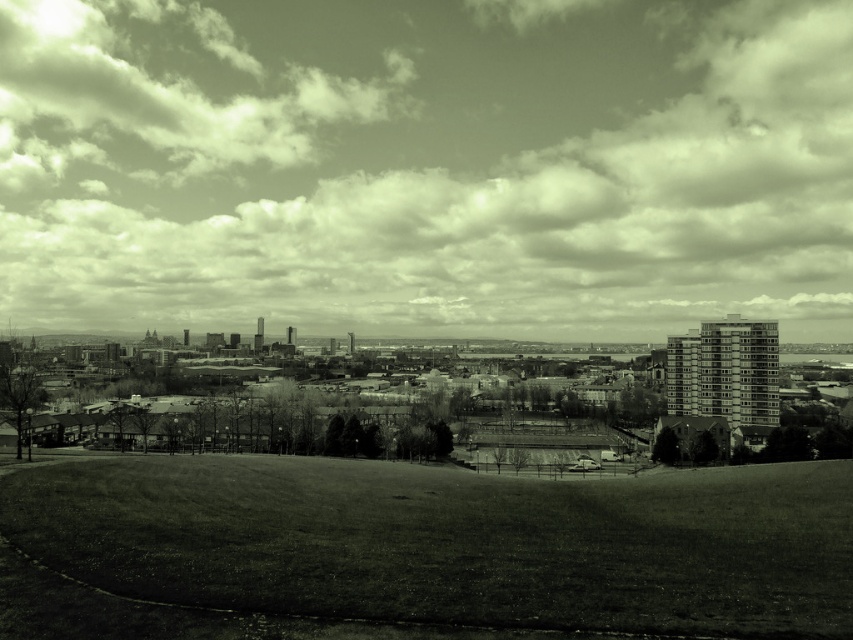
Question: Can you confirm if cloudy sky at upper center is positioned above green grass at center?

Choices:
 (A) yes
 (B) no

Answer: (A)

Question: Does cloudy sky at upper center have a greater width compared to green grass at center?

Choices:
 (A) yes
 (B) no

Answer: (A)

Question: Among these objects, which one is nearest to the camera?

Choices:
 (A) green grass at center
 (B) cloudy sky at upper center

Answer: (A)

Question: Among these points, which one is farthest from the camera?

Choices:
 (A) (456, 477)
 (B) (595, 13)

Answer: (B)

Question: Observing the image, what is the correct spatial positioning of cloudy sky at upper center in reference to green grass at center?

Choices:
 (A) below
 (B) above

Answer: (B)